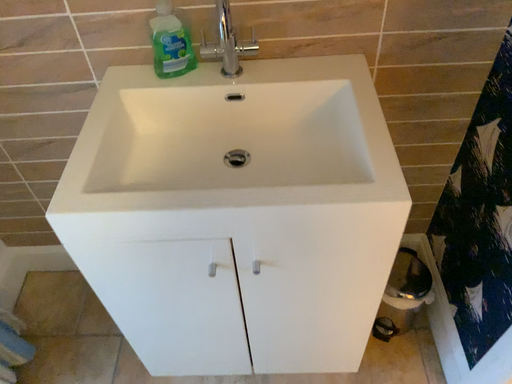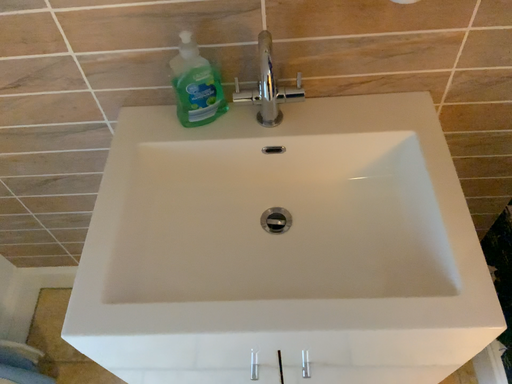
Question: How did the camera likely rotate when shooting the video?

Choices:
 (A) rotated downward
 (B) rotated upward

Answer: (A)